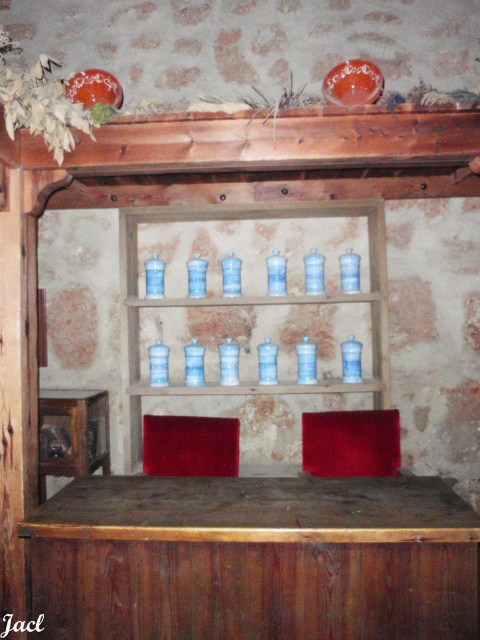
Does point (256, 218) come farther from viewer compared to point (284, 387)?

Yes, it is behind point (284, 387).

Between point (142, 388) and point (143, 307), which one is positioned in front?

Positioned in front is point (142, 388).

Where is `blue glass jars at center`? This screenshot has width=480, height=640. blue glass jars at center is located at coordinates (244, 304).